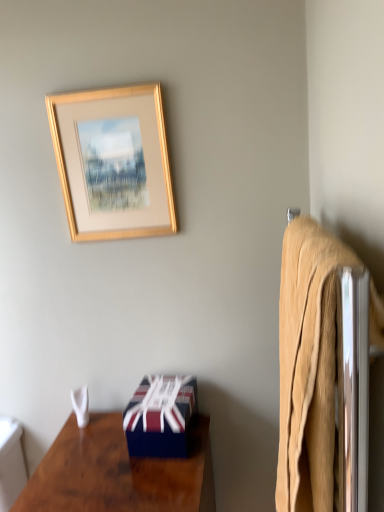
At what (x,y) coordinates should I click in order to perform the action: click on blank space to the left of blue glossy box at lower center. Please return your answer as a coordinate pair (x, y). The width and height of the screenshot is (384, 512). Looking at the image, I should click on (97, 445).